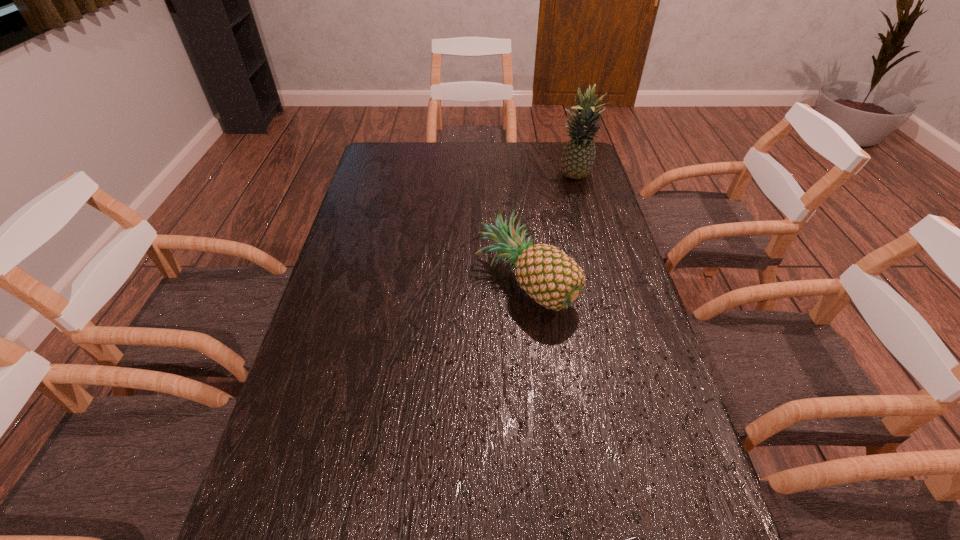
Where is `the closest object to the right pineapple`? The height and width of the screenshot is (540, 960). the closest object to the right pineapple is located at coordinates (548, 275).